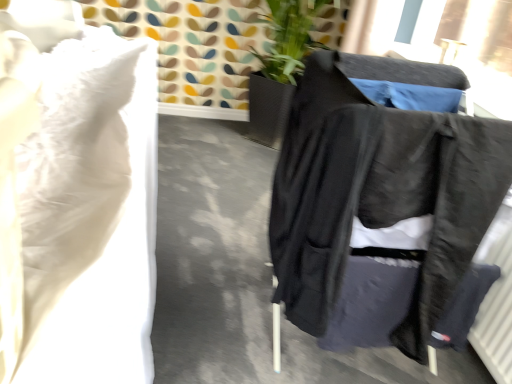
I want to click on white soft pillow at upper left, so click(78, 208).

The image size is (512, 384). What do you see at coordinates (78, 208) in the screenshot? I see `white soft pillow at upper left` at bounding box center [78, 208].

What is the approximate height of white soft pillow at upper left?

29.35 inches.

Locate an element on the screen. Image resolution: width=512 pixels, height=384 pixels. black fabric jacket at right is located at coordinates (380, 204).

This screenshot has height=384, width=512. What do you see at coordinates (380, 204) in the screenshot?
I see `black fabric jacket at right` at bounding box center [380, 204].

This screenshot has height=384, width=512. I want to click on white soft pillow at upper left, so 78,208.

Is black fabric jacket at right to the left of white soft pillow at upper left from the viewer's perspective?

Incorrect, black fabric jacket at right is not on the left side of white soft pillow at upper left.

Which object is closer to the camera taking this photo, black fabric jacket at right or white soft pillow at upper left?

white soft pillow at upper left.

Which point is more forward, (331, 269) or (50, 70)?

The point (331, 269) is in front.

From the image's perspective, is black fabric jacket at right above white soft pillow at upper left?

No, from the image's perspective, black fabric jacket at right is not over white soft pillow at upper left.

From a real-world perspective, which is physically below, black fabric jacket at right or white soft pillow at upper left?

From a 3D spatial view, white soft pillow at upper left is below.

Considering the relative sizes of black fabric jacket at right and white soft pillow at upper left in the image provided, is black fabric jacket at right thinner than white soft pillow at upper left?

Indeed, black fabric jacket at right has a lesser width compared to white soft pillow at upper left.

Is black fabric jacket at right taller or shorter than white soft pillow at upper left?

black fabric jacket at right is taller than white soft pillow at upper left.

Based on their sizes in the image, would you say black fabric jacket at right is bigger or smaller than white soft pillow at upper left?

In the image, black fabric jacket at right appears to be smaller than white soft pillow at upper left.

Is black fabric jacket at right surrounding white soft pillow at upper left?

No, black fabric jacket at right does not contain white soft pillow at upper left.

Would you consider black fabric jacket at right to be distant from white soft pillow at upper left?

No, black fabric jacket at right is in close proximity to white soft pillow at upper left.

Could you tell me if black fabric jacket at right is turned towards white soft pillow at upper left?

Yes, black fabric jacket at right faces towards white soft pillow at upper left.

Consider the image. How distant is black fabric jacket at right from white soft pillow at upper left?

They are 23.66 inches apart.

Locate an element on the screen. furniture that appears on the right of white soft pillow at upper left is located at coordinates (380, 204).

Can you confirm if white soft pillow at upper left is positioned to the right of black fabric jacket at right?

No, white soft pillow at upper left is not to the right of black fabric jacket at right.

Is white soft pillow at upper left closer to the viewer compared to black fabric jacket at right?

Yes, it is.

Considering the positions of point (37, 112) and point (325, 95), is point (37, 112) closer or farther from the camera than point (325, 95)?

Point (37, 112) is positioned closer to the camera compared to point (325, 95).

From the image's perspective, who appears lower, white soft pillow at upper left or black fabric jacket at right?

black fabric jacket at right appears lower in the image.

From a real-world perspective, is white soft pillow at upper left located beneath black fabric jacket at right?

Yes.

Can you confirm if white soft pillow at upper left is wider than black fabric jacket at right?

Yes, white soft pillow at upper left is wider than black fabric jacket at right.

Is white soft pillow at upper left taller than black fabric jacket at right?

No, white soft pillow at upper left is not taller than black fabric jacket at right.

Does white soft pillow at upper left have a larger size compared to black fabric jacket at right?

Yes, white soft pillow at upper left is bigger than black fabric jacket at right.

Is white soft pillow at upper left outside of black fabric jacket at right?

That's correct, white soft pillow at upper left is outside of black fabric jacket at right.

Are white soft pillow at upper left and black fabric jacket at right located far from each other?

No, white soft pillow at upper left is not far from black fabric jacket at right.

Is white soft pillow at upper left facing towards black fabric jacket at right?

No, white soft pillow at upper left is not turned towards black fabric jacket at right.

How many degrees apart are the facing directions of white soft pillow at upper left and black fabric jacket at right?

They differ by 2.55 degrees in their facing directions.

In the scene shown: How much distance is there between white soft pillow at upper left and black fabric jacket at right?

white soft pillow at upper left and black fabric jacket at right are 23.66 inches apart.

The width and height of the screenshot is (512, 384). In order to click on furniture that is behind the white soft pillow at upper left in this screenshot , I will do `click(380, 204)`.

The image size is (512, 384). In the image, there is a black fabric jacket at right. What are the coordinates of `sheet below it (from a real-world perspective)` in the screenshot? It's located at (78, 208).

Locate an element on the screen. sheet above the black fabric jacket at right (from the image's perspective) is located at coordinates (78, 208).